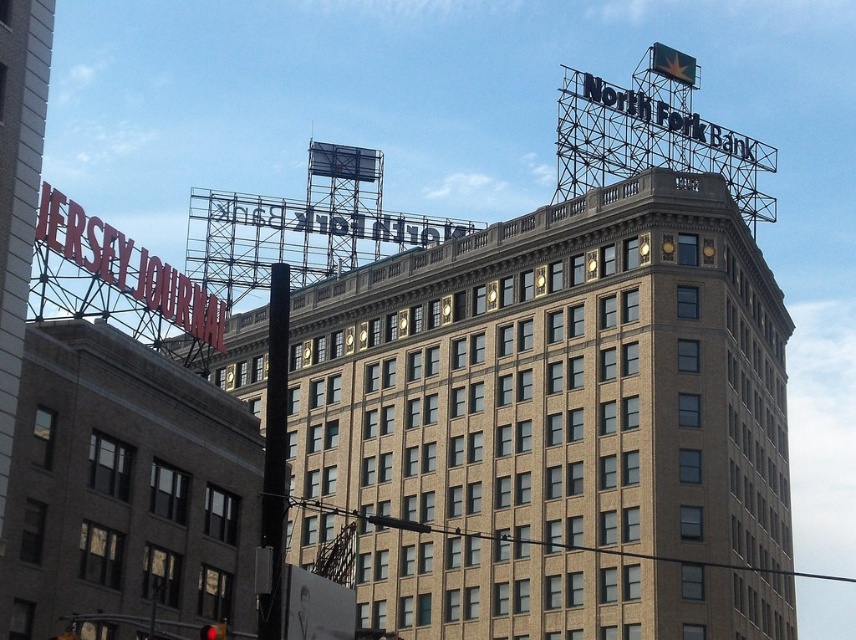
You are a city planner reviewing this urban layout. You need to determine the spatial relationship between the brown brick building at center and the red metal sign at upper left. Which one is located to the right of the other?

The brown brick building at center is positioned on the right side of red metal sign at upper left, so the brown brick building at center is to the right of the red metal sign at upper left.

You are a photographer standing in the middle of the street. You want to take a photo that includes both the brown brick building at center and the red metal sign at upper left. Which object will appear larger in your photo?

The brown brick building at center appears larger in the photo because it is closer to the viewer than the red metal sign at upper left.

You are an urban planner assessing the width of structures in the scene. Given that the brown brick building at center and the red metal sign at upper left are both visible, which one do you think has a greater width?

The brown brick building at center might be wider than red metal sign at upper left according to the description.